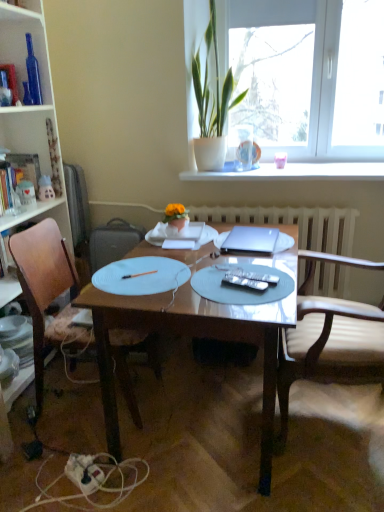
Find the location of `space that is in front of white paper notebook at center`. space that is in front of white paper notebook at center is located at coordinates (188, 259).